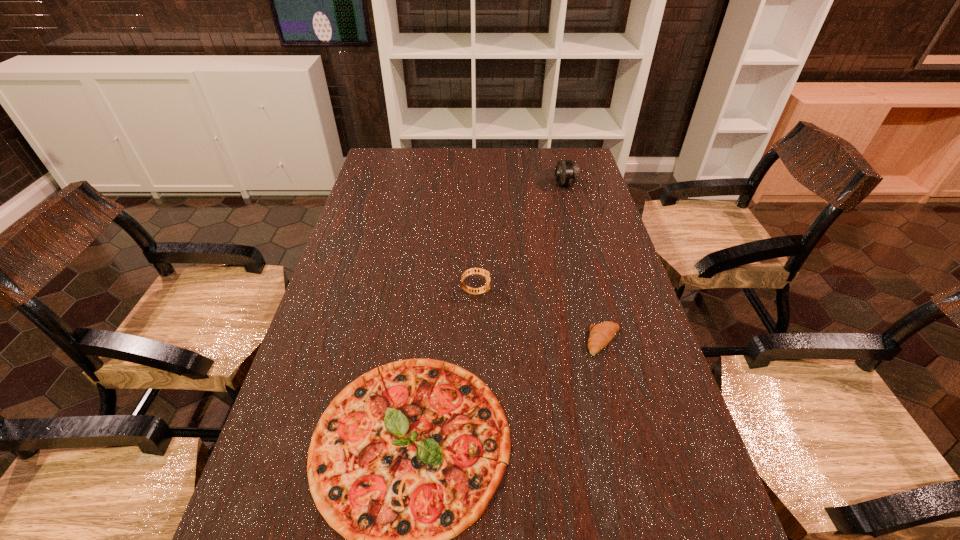
Where is `vacant area between the second farthest object and the telephoto lens`? This screenshot has width=960, height=540. vacant area between the second farthest object and the telephoto lens is located at coordinates (520, 238).

You are a GUI agent. You are given a task and a screenshot of the screen. Output one action in this format:
    pyautogui.click(x=<x>, y=<y>)
    Task: Click on the vacant area that lies between the second tallest object and the tallest object
    The width and height of the screenshot is (960, 540).
    Given the screenshot: What is the action you would take?
    pyautogui.click(x=520, y=238)

Identify the location of vacant space that is in between the watch and the tallest object. [520, 238].

Locate an element on the screen. blank region between the farthest object and the second farthest object is located at coordinates (520, 238).

I want to click on object that is the third closest to the third farthest object, so click(567, 172).

Choose which object is the second nearest neighbor to the nearest object. Please provide its 2D coordinates. Your answer should be formatted as a tuple, i.e. [(x, y)], where the tuple contains the x and y coordinates of a point satisfying the conditions above.

[(472, 271)]

I want to click on free space that satisfies the following two spatial constraints: 1. on the back side of the crescent roll; 2. on the face of the third nearest object, so click(x=591, y=292).

Where is `blank area in the image that satisfies the following two spatial constraints: 1. on the front-facing side of the tallest object; 2. on the front side of the second nearest object`? blank area in the image that satisfies the following two spatial constraints: 1. on the front-facing side of the tallest object; 2. on the front side of the second nearest object is located at coordinates (607, 341).

Find the location of `free region that satisfies the following two spatial constraints: 1. on the face of the second farthest object; 2. on the back side of the second nearest object`. free region that satisfies the following two spatial constraints: 1. on the face of the second farthest object; 2. on the back side of the second nearest object is located at coordinates (475, 341).

The height and width of the screenshot is (540, 960). In order to click on vacant space that satisfies the following two spatial constraints: 1. on the back side of the third tallest object; 2. on the face of the second farthest object in this screenshot , I will do `click(591, 292)`.